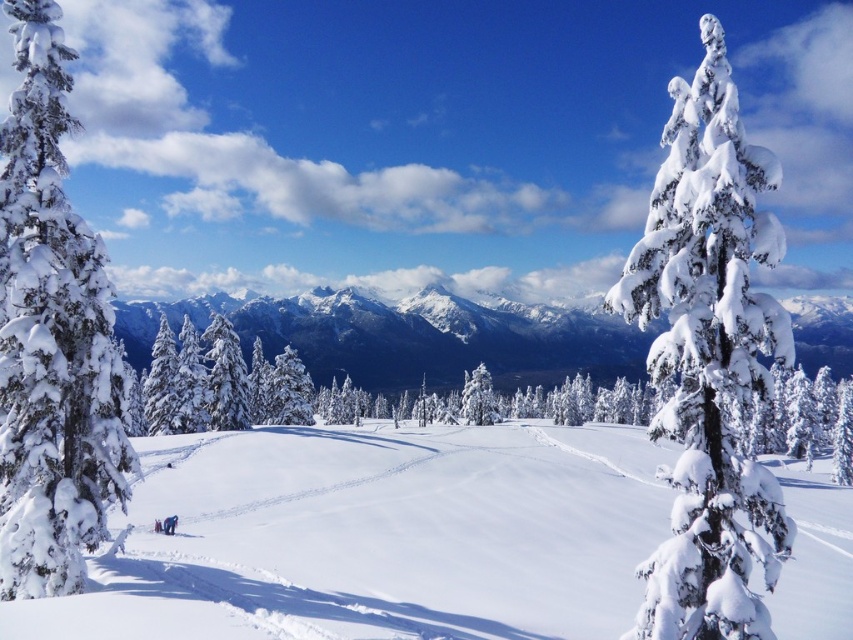
Question: Does white snow ski slope at center appear on the right side of snow-covered evergreen at right?

Choices:
 (A) no
 (B) yes

Answer: (A)

Question: Is snow-covered evergreen at right further to the viewer compared to white snowboard at lower left?

Choices:
 (A) no
 (B) yes

Answer: (A)

Question: Where is white fluffy snow-covered tree at left located in relation to white frosty tree at center in the image?

Choices:
 (A) left
 (B) right

Answer: (A)

Question: Which point appears closest to the camera in this image?

Choices:
 (A) (167, 532)
 (B) (344, 604)
 (C) (309, 340)

Answer: (B)

Question: Which of the following is the closest to the observer?

Choices:
 (A) white frosty tree at center
 (B) snow-covered evergreen at right
 (C) white fluffy snow-covered tree at left

Answer: (B)

Question: Based on their relative distances, which object is nearer to the snowy white mountain at center?

Choices:
 (A) white frosty tree at center
 (B) white fluffy snow-covered tree at left
 (C) snow-covered evergreen at right
 (D) white snow ski slope at center

Answer: (A)